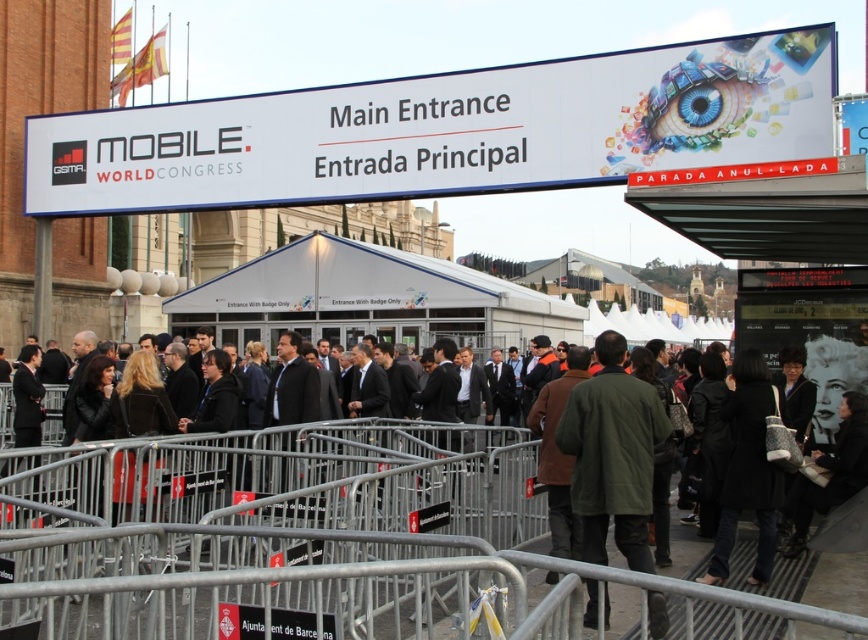
You are attending the Mobile World Congress and need to locate the main entrance. You see a white plastic sign at upper center and a dark brown leather jacket at center. Which object is positioned higher in the image?

The white plastic sign at upper center is positioned higher in the image than the dark brown leather jacket at center.